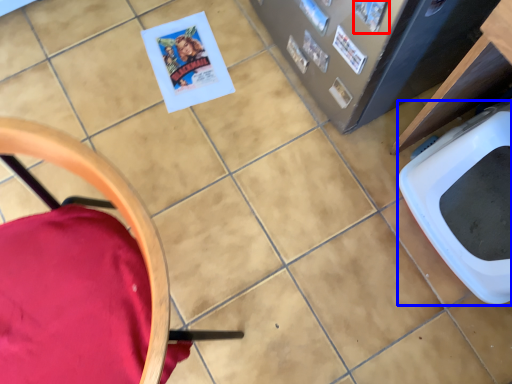
Question: Which object appears closest to the camera in this image, comic book (highlighted by a red box) or toilet bowl (highlighted by a blue box)?

Choices:
 (A) comic book
 (B) toilet bowl

Answer: (B)